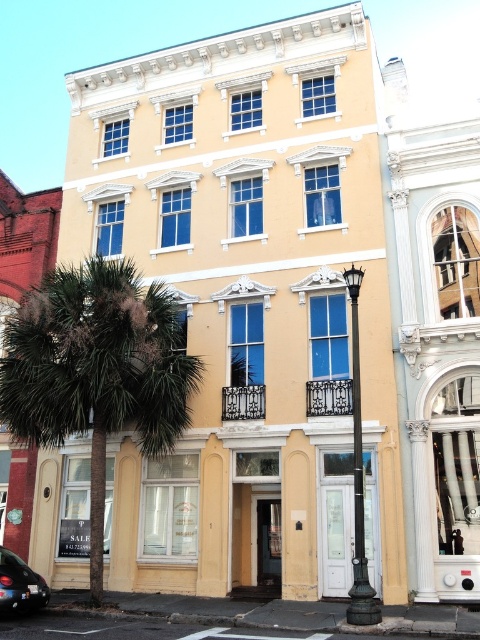
You are standing at the entrance of the building and want to water the green leafy palm tree at left. If your watering can has a range of 35 meters, can you reach it?

The green leafy palm tree at left is 34.94 meters away from the camera, so yes, the watering can with a 35 meter range can reach it.

You are standing in front of the building and notice the green leafy palm tree at left and the shiny black car at lower left. From your perspective, which object is positioned to the right?

The green leafy palm tree at left is positioned to the right of the shiny black car at lower left according to the description.